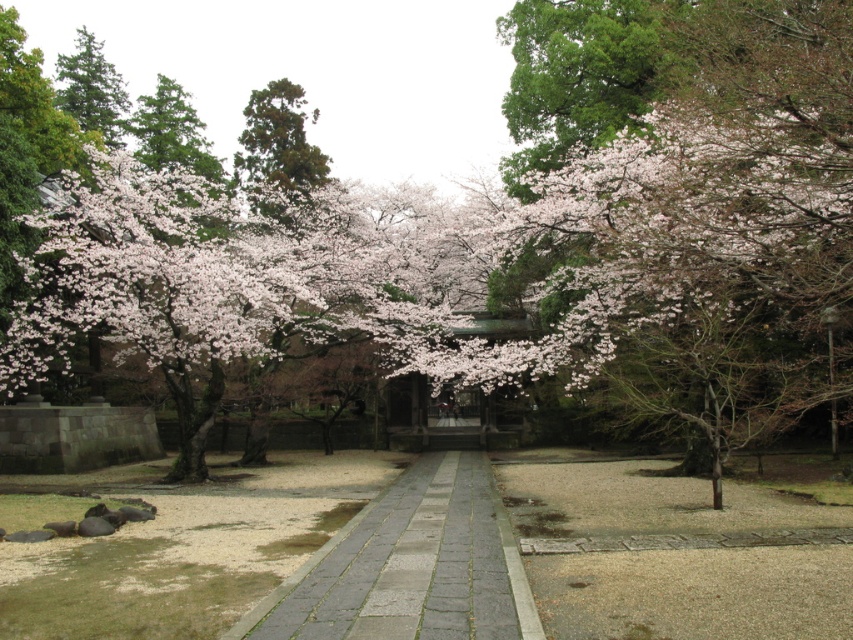
Which of these two, soft pink blossoms at center or green textured pine tree at upper center, stands shorter?

With less height is soft pink blossoms at center.

Can you confirm if soft pink blossoms at center is positioned to the right of green textured pine tree at upper center?

Yes, soft pink blossoms at center is to the right of green textured pine tree at upper center.

What do you see at coordinates (451, 253) in the screenshot?
I see `soft pink blossoms at center` at bounding box center [451, 253].

Where is `soft pink blossoms at center`? This screenshot has height=640, width=853. soft pink blossoms at center is located at coordinates [451, 253].

Does point (726, 188) come farther from viewer compared to point (418, 563)?

Yes.

Which of these two, soft pink blossoms at center or gray stone pavement at center, stands shorter?

With less height is gray stone pavement at center.

Does point (791, 221) come closer to viewer compared to point (370, 602)?

No, (791, 221) is further to viewer.

What are the coordinates of `soft pink blossoms at center` in the screenshot? It's located at (451, 253).

Who is shorter, gray stone pavement at center or green textured pine tree at upper center?

With less height is gray stone pavement at center.

From the picture: Who is more distant from viewer, [326,637] or [267,108]?

Positioned behind is point [267,108].

Where is `gray stone pavement at center`? gray stone pavement at center is located at coordinates (410, 566).